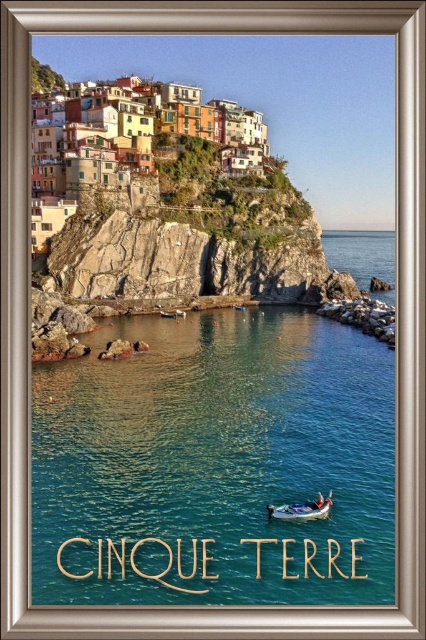
From the picture: You are a tourist standing on the cliff overlooking the village and the sea. You see the clear blue water at center and the teal plastic boat at lower center. Which object is positioned to the left of the other?

The clear blue water at center is to the left of the teal plastic boat at lower center.

You are a tourist standing on the cliff overlooking the village. You see the clear blue water at center and the teal plastic boat at lower center. Which object is closer to you?

The teal plastic boat at lower center is closer to you because it is positioned below the clear blue water at center, which is above it.

You are a tourist standing on the cliff overlooking the village in Cinque Terre. You want to take a photo of the clear blue water at center. Where should you point your camera to capture it?

You should point your camera towards the coordinates point at (215, 465) to capture the clear blue water at center.